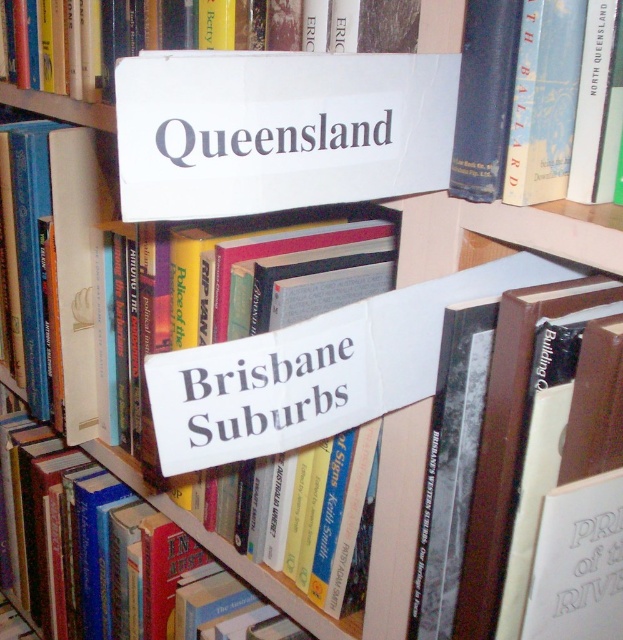
You are organizing books on a shelf and need to place a new book that is 2 cm thick. The blue hardcover book at upper right and the white paper sign at center are already on the shelf. Which existing item has more space between it and the next book if you place the new book next to both?

The blue hardcover book at upper right is thinner than the white paper sign at center, so placing the new book next to the blue hardcover book at upper right would leave more space between them compared to placing it next to the white paper sign at center.

You are organizing a library and need to place a new book that is 10 cm tall. You see the blue hardcover book at upper right and the white paper sign at center. Which object can the new book fit under without exceeding its height?

The new book that is 10 cm tall can fit under the white paper sign at center since the blue hardcover book at upper right is taller than the white paper sign at center.

You are standing in front of the bookshelf and notice two points marked on the image. The first point is at coordinate point (x=543, y=26) and the second is at point (x=341, y=394). Which point is closer to you?

Point (x=543, y=26) is closer to the camera than point (x=341, y=394), so the first point is closer to you.